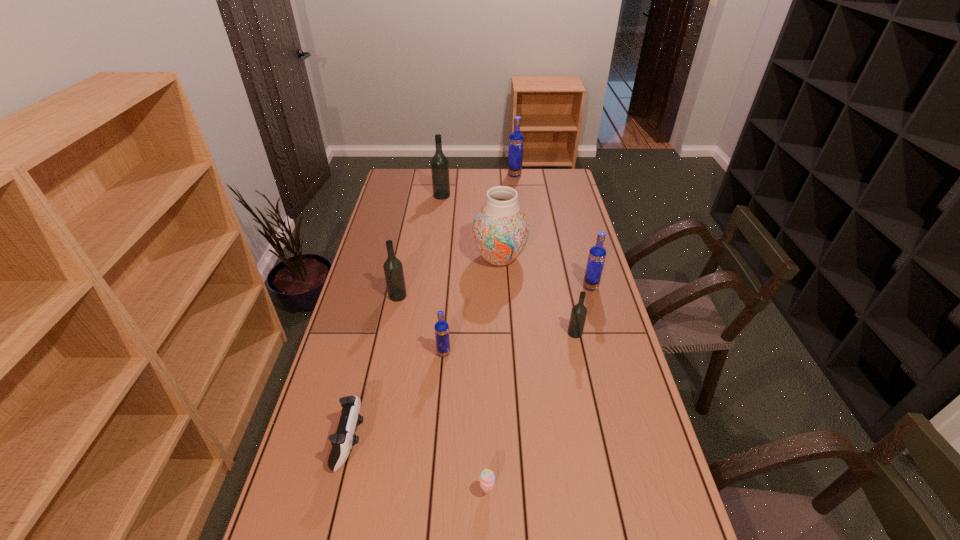
Identify which blue vodka is the closest to the smallest black vodka. Please provide its 2D coordinates. Your answer should be formatted as a tuple, i.e. [(x, y)], where the tuple contains the x and y coordinates of a point satisfying the conditions above.

[(597, 254)]

Point out which black vodka is positioned as the second nearest to the second object from right to left. Please provide its 2D coordinates. Your answer should be formatted as a tuple, i.e. [(x, y)], where the tuple contains the x and y coordinates of a point satisfying the conditions above.

[(439, 164)]

At what (x,y) coordinates should I click in order to perform the action: click on black vodka that is the second closest to the second nearest object. Please return your answer as a coordinate pair (x, y). The image size is (960, 540). Looking at the image, I should click on (579, 312).

This screenshot has width=960, height=540. Find the location of `free space that satisfies the following two spatial constraints: 1. on the front side of the third vodka from right to left; 2. on the right side of the fourth nearest object`. free space that satisfies the following two spatial constraints: 1. on the front side of the third vodka from right to left; 2. on the right side of the fourth nearest object is located at coordinates (534, 333).

In order to click on free space in the image that satisfies the following two spatial constraints: 1. on the back side of the seventh nearest object; 2. on the right side of the farthest blue vodka in this screenshot , I will do `click(495, 175)`.